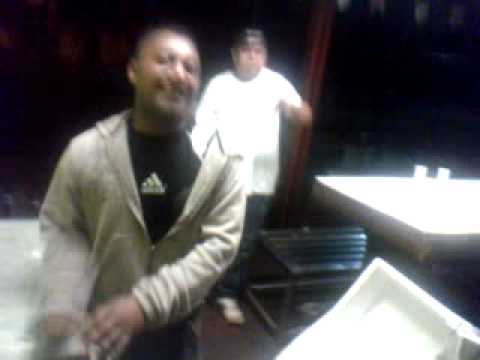
Where is `table`? This screenshot has height=360, width=480. table is located at coordinates (404, 208).